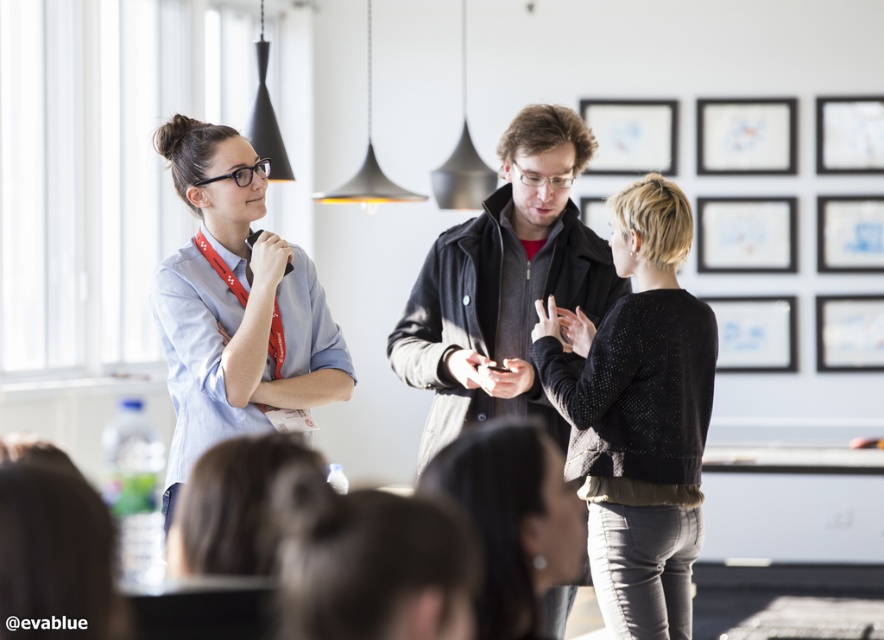
Is the position of dark gray jacket at center less distant than that of matte black jacket at center?

That is False.

Between dark gray jacket at center and matte black jacket at center, which one appears on the left side from the viewer's perspective?

matte black jacket at center

Where is `dark gray jacket at center`? dark gray jacket at center is located at coordinates (504, 284).

Which is more to the right, black textured sweater at center or matte black jacket at center?

From the viewer's perspective, black textured sweater at center appears more on the right side.

Does black textured sweater at center have a lesser width compared to matte black jacket at center?

In fact, black textured sweater at center might be wider than matte black jacket at center.

Based on the photo, who is more distant from viewer, (652, 484) or (566, 502)?

The point (652, 484) is more distant.

Where is `black textured sweater at center`? Image resolution: width=884 pixels, height=640 pixels. black textured sweater at center is located at coordinates (638, 416).

Does black textured sweater at center appear over dark gray jacket at center?

Incorrect, black textured sweater at center is not positioned above dark gray jacket at center.

Describe the element at coordinates (638, 416) in the screenshot. Image resolution: width=884 pixels, height=640 pixels. I see `black textured sweater at center` at that location.

Is point (695, 522) positioned in front of point (389, 336)?

Yes, point (695, 522) is in front of point (389, 336).

Find the location of a particular element. The width and height of the screenshot is (884, 640). black textured sweater at center is located at coordinates (638, 416).